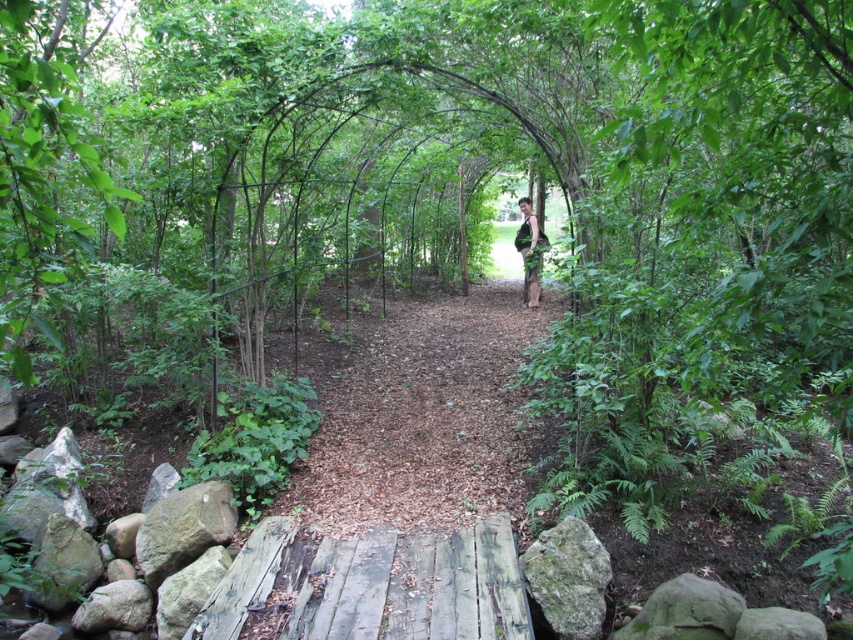
The height and width of the screenshot is (640, 853). What do you see at coordinates (369, 586) in the screenshot? I see `weathered wooden bridge at lower center` at bounding box center [369, 586].

Is point (397, 540) in front of point (526, 208)?

Yes, point (397, 540) is in front of point (526, 208).

Who is more forward, (270, 557) or (540, 243)?

Point (270, 557)

Image resolution: width=853 pixels, height=640 pixels. Find the location of `weathered wooden bridge at lower center`. weathered wooden bridge at lower center is located at coordinates (369, 586).

Which is more to the right, wooden planks at center or weathered wooden bridge at lower center?

wooden planks at center is more to the right.

Where is `wooden planks at center`? wooden planks at center is located at coordinates (399, 492).

Locate an element on the screen. The image size is (853, 640). wooden planks at center is located at coordinates (399, 492).

Who is lower down, wooden planks at center or green fabric pants at center?

wooden planks at center is lower down.

This screenshot has height=640, width=853. What do you see at coordinates (399, 492) in the screenshot?
I see `wooden planks at center` at bounding box center [399, 492].

Does point (431, 346) come farther from viewer compared to point (534, 252)?

No, it is not.

Locate an element on the screen. wooden planks at center is located at coordinates (399, 492).